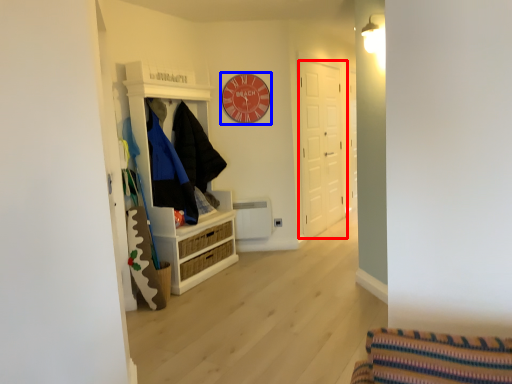
Question: Which point is further to the camera, door (highlighted by a red box) or clock (highlighted by a blue box)?

Choices:
 (A) door
 (B) clock

Answer: (A)